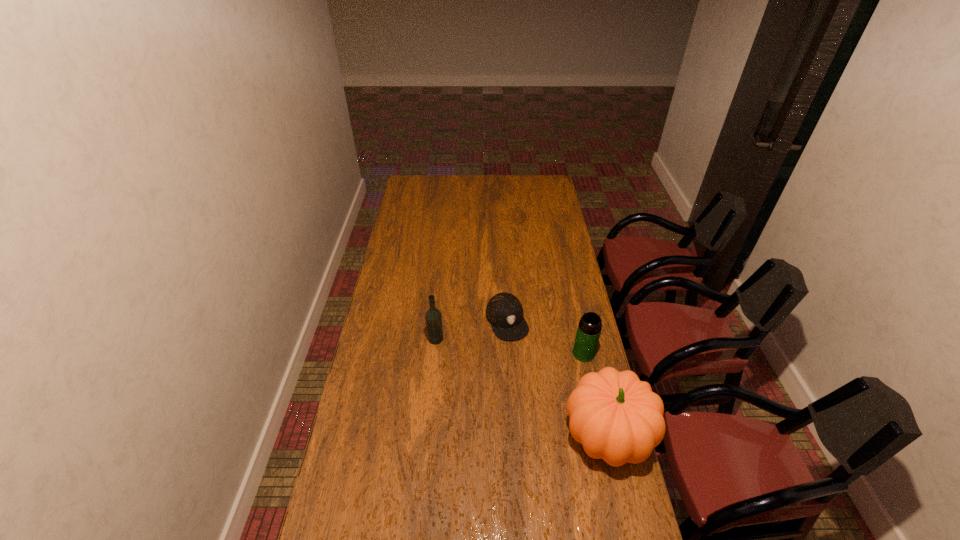
Where is `free space on the desktop that is between the leftmost object and the pumpkin and is positioned on the front-facing side of the shortest object`? This screenshot has height=540, width=960. free space on the desktop that is between the leftmost object and the pumpkin and is positioned on the front-facing side of the shortest object is located at coordinates (540, 397).

Locate an element on the screen. Image resolution: width=960 pixels, height=540 pixels. vacant space on the desktop that is between the leftmost object and the pumpkin and is positioned from the spout of the thermos bottle is located at coordinates (490, 369).